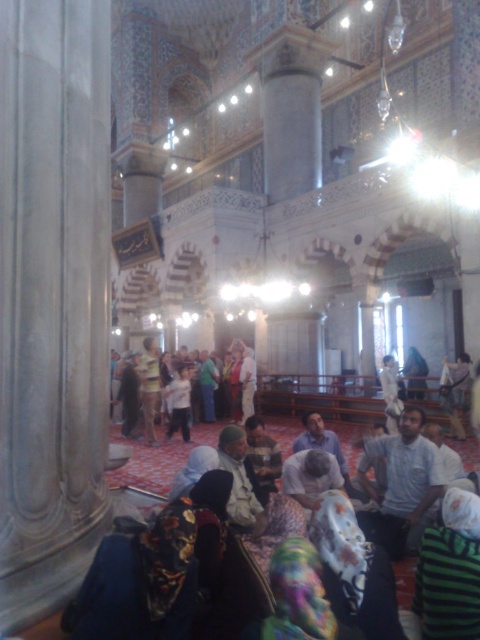
Question: In this image, where is light gray shirt at center located relative to light brown leather jacket at center?

Choices:
 (A) right
 (B) left

Answer: (A)

Question: Which point is farther to the camera?

Choices:
 (A) light gray shirt at center
 (B) light brown leather jacket at center

Answer: (B)

Question: Does light gray shirt at center have a smaller size compared to light brown leather jacket at center?

Choices:
 (A) no
 (B) yes

Answer: (B)

Question: Which of the following is the farthest from the observer?

Choices:
 (A) light brown leather jacket at center
 (B) light gray shirt at center

Answer: (A)

Question: Does light gray shirt at center appear over light brown leather jacket at center?

Choices:
 (A) no
 (B) yes

Answer: (A)